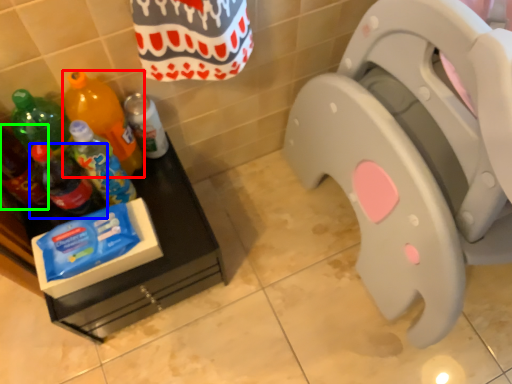
Question: Estimate the real-world distances between objects in this image. Which object is closer to bottle (highlighted by a red box), bottle (highlighted by a blue box) or bottle (highlighted by a green box)?

Choices:
 (A) bottle
 (B) bottle

Answer: (A)